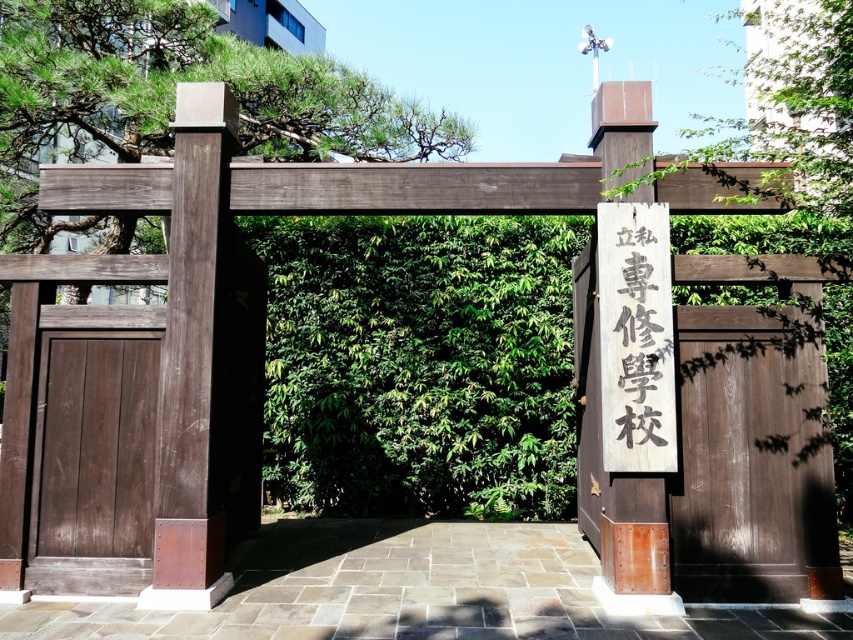
Is point (154, 332) less distant than point (799, 83)?

Yes, point (154, 332) is in front of point (799, 83).

The image size is (853, 640). What do you see at coordinates (93, 461) in the screenshot?
I see `dark brown wood door at left` at bounding box center [93, 461].

Who is more forward, [148,508] or [758,24]?

Point [148,508] is in front.

Locate an element on the screen. The height and width of the screenshot is (640, 853). dark brown wood door at left is located at coordinates (93, 461).

Based on the photo, can you confirm if brown wooden door at center is positioned below green leafy tree at center?

Correct, brown wooden door at center is located below green leafy tree at center.

Between point (679, 452) and point (788, 100), which one is positioned in front?

Point (679, 452) is in front.

Locate an element on the screen. The height and width of the screenshot is (640, 853). brown wooden door at center is located at coordinates (751, 456).

At what (x,y) coordinates should I click in order to perform the action: click on brown wooden door at center. Please return your answer as a coordinate pair (x, y). Looking at the image, I should click on (751, 456).

Find the location of `brown wooden door at center`. brown wooden door at center is located at coordinates (751, 456).